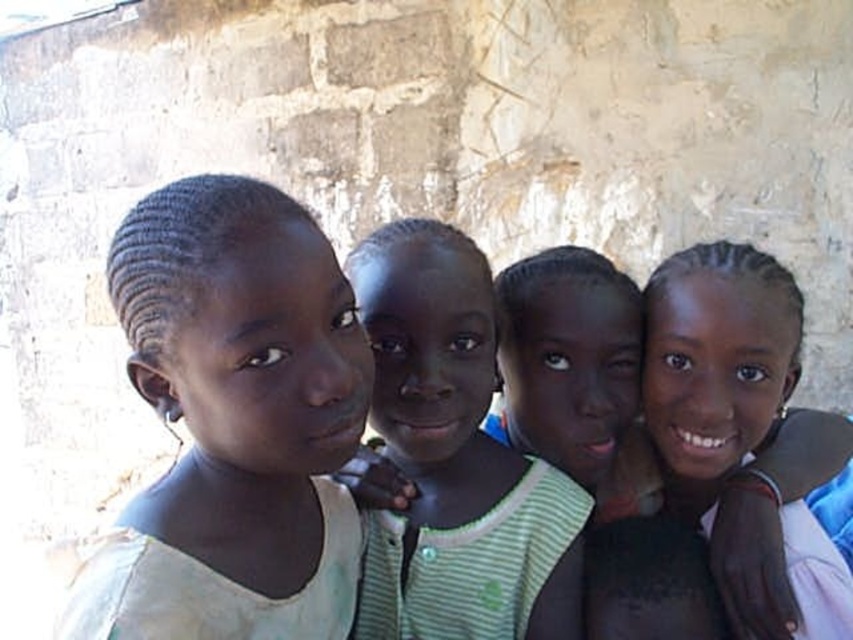
Question: Which object is the closest to the light beige fabric at center?

Choices:
 (A) green striped shirt at center
 (B) smooth skin girl at right

Answer: (A)

Question: Considering the relative positions of light beige fabric at center and smooth skin girl at right in the image provided, where is light beige fabric at center located with respect to smooth skin girl at right?

Choices:
 (A) right
 (B) left

Answer: (B)

Question: Considering the relative positions of light beige fabric at center and smooth skin girl at right in the image provided, where is light beige fabric at center located with respect to smooth skin girl at right?

Choices:
 (A) below
 (B) above

Answer: (B)

Question: Which point is farther from the camera taking this photo?

Choices:
 (A) (665, 422)
 (B) (219, 385)

Answer: (A)

Question: Does light beige fabric at center have a greater width compared to smooth skin girl at right?

Choices:
 (A) yes
 (B) no

Answer: (B)

Question: Which point is closer to the camera?

Choices:
 (A) 650,300
 (B) 413,324
 (C) 256,561

Answer: (C)